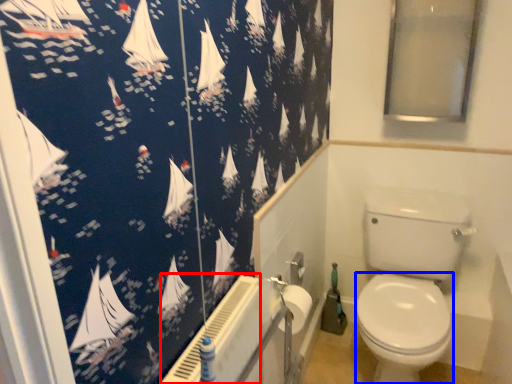
Question: Which point is further to the camera, radiator (highlighted by a red box) or bidet (highlighted by a blue box)?

Choices:
 (A) radiator
 (B) bidet

Answer: (B)